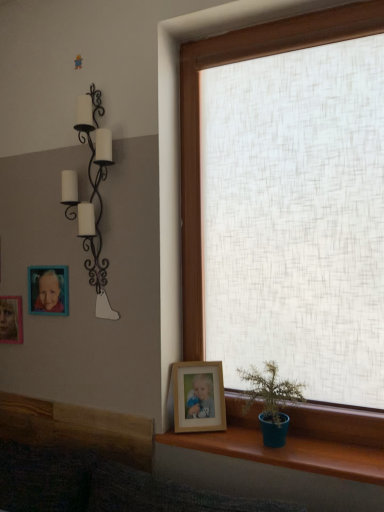
Question: Does black wrought iron candle holder at upper left come behind matte plastic picture frame at upper left, the second picture frame from the back?

Choices:
 (A) yes
 (B) no

Answer: (B)

Question: Is matte plastic picture frame at upper left, which appears as the first picture frame when viewed from the top, surrounded by black wrought iron candle holder at upper left?

Choices:
 (A) no
 (B) yes

Answer: (A)

Question: Can you confirm if black wrought iron candle holder at upper left is thinner than matte plastic picture frame at upper left, placed as the third picture frame when sorted from bottom to top?

Choices:
 (A) yes
 (B) no

Answer: (B)

Question: Can you confirm if black wrought iron candle holder at upper left is bigger than matte plastic picture frame at upper left, positioned as the second picture frame in left-to-right order?

Choices:
 (A) no
 (B) yes

Answer: (B)

Question: Does black wrought iron candle holder at upper left have a greater width compared to matte plastic picture frame at upper left, the 2th picture frame positioned from the right?

Choices:
 (A) no
 (B) yes

Answer: (B)

Question: From a real-world perspective, is black wrought iron candle holder at upper left beneath matte plastic picture frame at upper left, arranged as the 2th picture frame when viewed from the front?

Choices:
 (A) no
 (B) yes

Answer: (A)

Question: Does black wrought iron candle holder at upper left have a greater height compared to teak wood window sill at lower right?

Choices:
 (A) yes
 (B) no

Answer: (A)

Question: Does black wrought iron candle holder at upper left come behind teak wood window sill at lower right?

Choices:
 (A) no
 (B) yes

Answer: (B)

Question: Does black wrought iron candle holder at upper left come in front of teak wood window sill at lower right?

Choices:
 (A) yes
 (B) no

Answer: (B)

Question: Considering the relative sizes of black wrought iron candle holder at upper left and teak wood window sill at lower right in the image provided, is black wrought iron candle holder at upper left bigger than teak wood window sill at lower right?

Choices:
 (A) yes
 (B) no

Answer: (A)

Question: Would you consider black wrought iron candle holder at upper left to be distant from teak wood window sill at lower right?

Choices:
 (A) yes
 (B) no

Answer: (B)

Question: From a real-world perspective, is black wrought iron candle holder at upper left beneath teak wood window sill at lower right?

Choices:
 (A) yes
 (B) no

Answer: (B)

Question: Can you confirm if teal ceramic pot at lower right is positioned to the left of teak wood window sill at lower right?

Choices:
 (A) no
 (B) yes

Answer: (B)